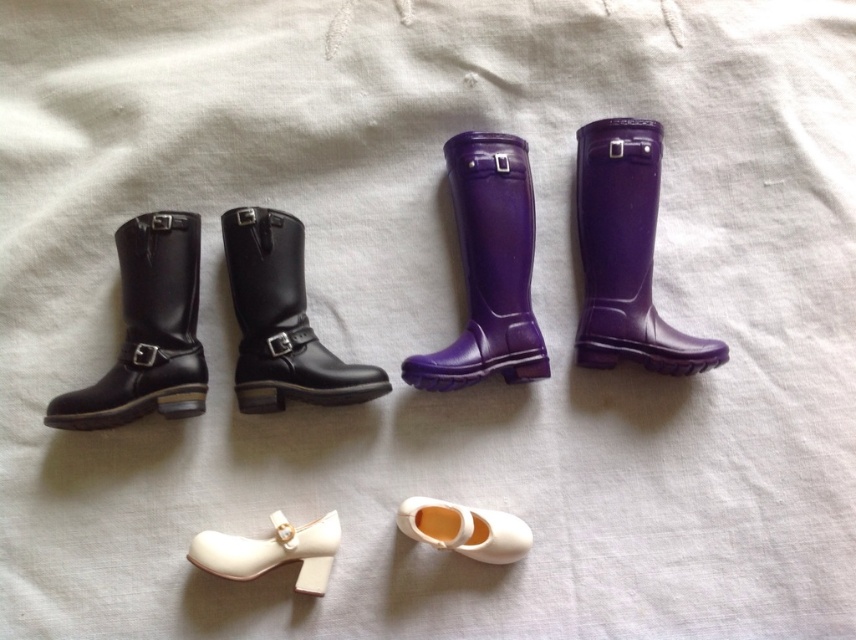
You are a tiny explorer standing on the plain white fabric background. You see the black leather boot at left represented by point (147,330). Can you walk around it without stepping on the boot?

The black leather boot at left is represented by point (147,330). Since the boot is a single point, you can easily walk around it without stepping on the boot.

You are a collector organizing miniature shoes. You have a black leather boot at left and a white matte shoe at lower center. Which one is closer to you?

The black leather boot at left is closer because it is in front of the white matte shoe at lower center.

You are organizing a dollhouse and need to place the black leather boot at center and the white leather shoe at lower center. Based on their positions, which object should you place first if you want to follow the left to right arrangement?

The black leather boot at center should be placed first because it is positioned to the left of the white leather shoe at lower center, following the left to right arrangement.